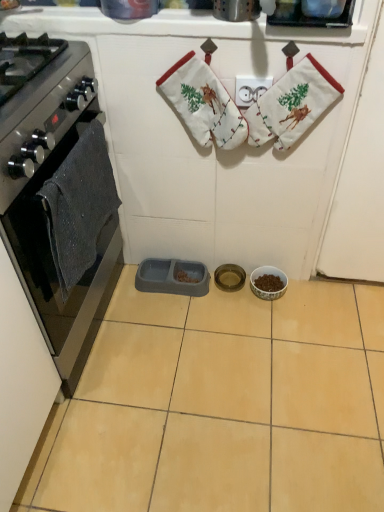
Question: Considering the relative sizes of gray plastic pet feeder at center, arranged as the 1th appliance when viewed from the left, and white cotton hand towel at upper center, acting as the first hand towel starting from the right, in the image provided, is gray plastic pet feeder at center, arranged as the 1th appliance when viewed from the left, thinner than white cotton hand towel at upper center, acting as the first hand towel starting from the right,?

Choices:
 (A) yes
 (B) no

Answer: (B)

Question: Is gray plastic pet feeder at center, which is the third appliance in right-to-left order, not within white cotton hand towel at upper center, acting as the first hand towel starting from the right?

Choices:
 (A) yes
 (B) no

Answer: (A)

Question: From the image's perspective, is gray plastic pet feeder at center, arranged as the 1th appliance when viewed from the left, below white cotton hand towel at upper center, which appears as the second hand towel when viewed from the left?

Choices:
 (A) yes
 (B) no

Answer: (A)

Question: From a real-world perspective, is gray plastic pet feeder at center, which is the third appliance in right-to-left order, on white cotton hand towel at upper center, which appears as the second hand towel when viewed from the left?

Choices:
 (A) yes
 (B) no

Answer: (B)

Question: Is white cotton hand towel at upper center, which appears as the second hand towel when viewed from the left, surrounded by gray plastic pet feeder at center, arranged as the 1th appliance when viewed from the left?

Choices:
 (A) yes
 (B) no

Answer: (B)

Question: Relative to white cotton hand towel at upper center, which appears as the second hand towel when viewed from the left, is porcelain bowl at center, which is the first appliance from right to left, in front or behind?

Choices:
 (A) behind
 (B) front

Answer: (A)

Question: From a real-world perspective, is porcelain bowl at center, the third appliance in the left-to-right sequence, above or below white cotton hand towel at upper center, acting as the first hand towel starting from the right?

Choices:
 (A) above
 (B) below

Answer: (B)

Question: From the image's perspective, is porcelain bowl at center, the third appliance in the left-to-right sequence, located above or below white cotton hand towel at upper center, acting as the first hand towel starting from the right?

Choices:
 (A) above
 (B) below

Answer: (B)

Question: Would you say porcelain bowl at center, which is the first appliance from right to left, is to the left or to the right of white cotton hand towel at upper center, acting as the first hand towel starting from the right, in the picture?

Choices:
 (A) right
 (B) left

Answer: (A)

Question: Considering the positions of white fabric stocking at upper center and white cotton hand towel at upper center, which appears as the second hand towel when viewed from the left, in the image, is white fabric stocking at upper center taller or shorter than white cotton hand towel at upper center, which appears as the second hand towel when viewed from the left,?

Choices:
 (A) tall
 (B) short

Answer: (B)

Question: Is white fabric stocking at upper center to the left or to the right of white cotton hand towel at upper center, which appears as the second hand towel when viewed from the left, in the image?

Choices:
 (A) left
 (B) right

Answer: (B)

Question: Considering the positions of white fabric stocking at upper center and white cotton hand towel at upper center, which appears as the second hand towel when viewed from the left, in the image, is white fabric stocking at upper center wider or thinner than white cotton hand towel at upper center, which appears as the second hand towel when viewed from the left,?

Choices:
 (A) wide
 (B) thin

Answer: (A)

Question: Is point (291, 78) positioned closer to the camera than point (221, 82)?

Choices:
 (A) closer
 (B) farther

Answer: (A)

Question: Relative to metallic gold bowl at center, which ranks as the second appliance in left-to-right order, is beige ceramic tile at center in front or behind?

Choices:
 (A) front
 (B) behind

Answer: (A)

Question: Is beige ceramic tile at center taller or shorter than metallic gold bowl at center, which ranks as the second appliance in left-to-right order?

Choices:
 (A) tall
 (B) short

Answer: (B)